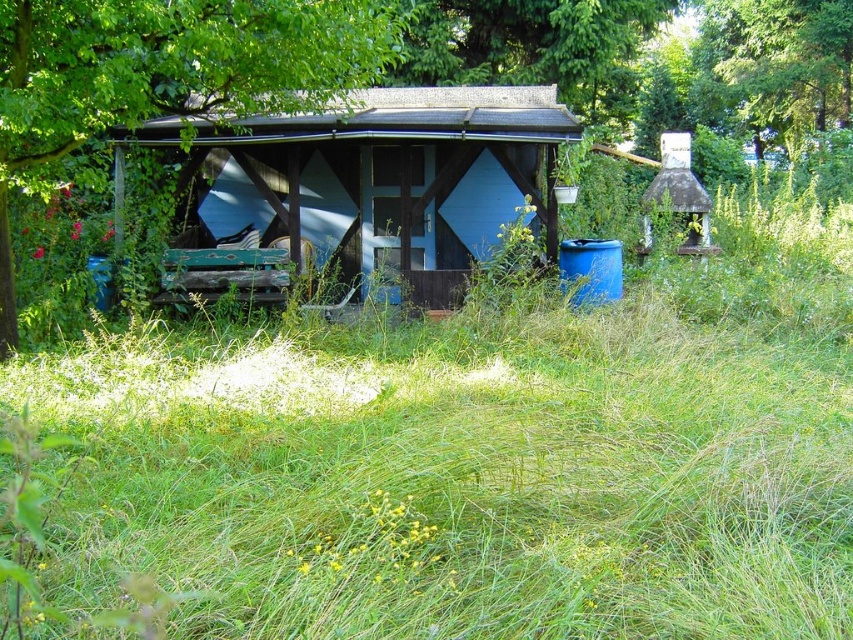
You are a delivery person carrying a package that requires a 2.5 meter clearance to pass safely between the wooden hut at center and the green leafy tree at upper left. Can you safely navigate through this path?

The wooden hut at center is 2.19 meters away from the green leafy tree at upper left. Since the required clearance is 2.5 meters, the distance is insufficient. Therefore, you cannot safely navigate through this path.

You are standing in front of the rustic wooden structure and notice two points marked in the scene. The first point is at coordinates point (338,196) and the second point is at point (3,248). Which of these points is closer to your current position?

Point (338,196) is further to the camera than point (3,248), so the point closer to your current position is point (3,248).